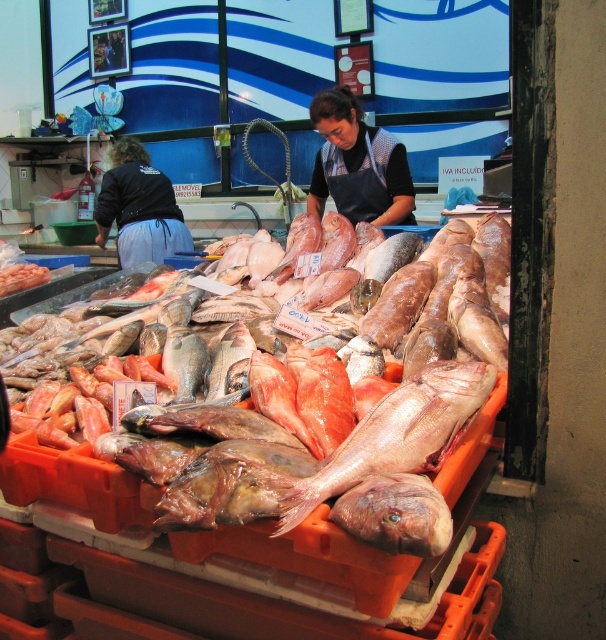
Can you confirm if pink glossy fish at center is bigger than pink flesh at center?

Indeed, pink glossy fish at center has a larger size compared to pink flesh at center.

I want to click on pink glossy fish at center, so click(398, 433).

Which is behind, point (473, 401) or point (416, 499)?

Positioned behind is point (473, 401).

What are the coordinates of `pink glossy fish at center` in the screenshot? It's located at (398, 433).

Who is positioned more to the left, black apron at center or pink flesh at center?

pink flesh at center

Looking at this image, is black apron at center wider than pink flesh at center?

Correct, the width of black apron at center exceeds that of pink flesh at center.

Which is in front, point (327, 195) or point (341, 522)?

Point (341, 522)

You are a GUI agent. You are given a task and a screenshot of the screen. Output one action in this format:
    pyautogui.click(x=<x>, y=<y>)
    Task: Click on the black apron at center
    
    Given the screenshot: What is the action you would take?
    pyautogui.click(x=358, y=164)

From the picture: Which is above, pink fleshed fish at center or black fabric apron at left?

black fabric apron at left

Does pink fleshed fish at center come behind black fabric apron at left?

That is False.

Does point (233, 429) lie behind point (191, 244)?

No, (233, 429) is in front of (191, 244).

You are a GUI agent. You are given a task and a screenshot of the screen. Output one action in this format:
    pyautogui.click(x=<x>, y=<y>)
    Task: Click on the pink fleshed fish at center
    This screenshot has height=640, width=606.
    Given the screenshot: What is the action you would take?
    point(311,410)